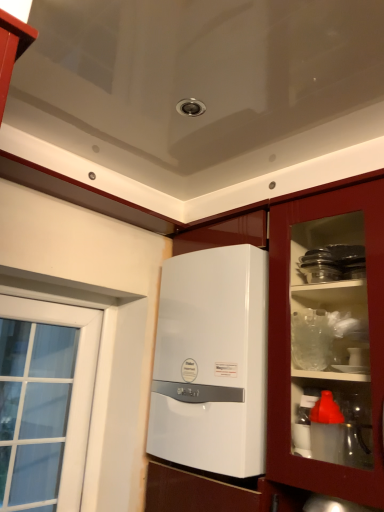
Question: Does white glossy boiler at center have a smaller size compared to white glossy cabinet at center?

Choices:
 (A) yes
 (B) no

Answer: (A)

Question: From a real-world perspective, is white glossy boiler at center on top of white glossy cabinet at center?

Choices:
 (A) yes
 (B) no

Answer: (A)

Question: Considering the relative sizes of white glossy boiler at center and white glossy cabinet at center in the image provided, is white glossy boiler at center thinner than white glossy cabinet at center?

Choices:
 (A) yes
 (B) no

Answer: (A)

Question: Considering the relative sizes of white glossy boiler at center and white glossy cabinet at center in the image provided, is white glossy boiler at center shorter than white glossy cabinet at center?

Choices:
 (A) yes
 (B) no

Answer: (A)

Question: From the image's perspective, does white glossy boiler at center appear higher than white glossy cabinet at center?

Choices:
 (A) yes
 (B) no

Answer: (A)

Question: Can you confirm if white glossy boiler at center is bigger than white glossy cabinet at center?

Choices:
 (A) yes
 (B) no

Answer: (B)

Question: Does white glossy cabinet at center have a larger size compared to white glossy boiler at center?

Choices:
 (A) no
 (B) yes

Answer: (B)

Question: Can we say white glossy cabinet at center lies outside white glossy boiler at center?

Choices:
 (A) no
 (B) yes

Answer: (A)

Question: From the image's perspective, is white glossy cabinet at center under white glossy boiler at center?

Choices:
 (A) yes
 (B) no

Answer: (A)

Question: Can you confirm if white glossy cabinet at center is smaller than white glossy boiler at center?

Choices:
 (A) no
 (B) yes

Answer: (A)

Question: Does white glossy cabinet at center come behind white glossy boiler at center?

Choices:
 (A) yes
 (B) no

Answer: (B)

Question: Would you say white glossy boiler at center is part of white glossy cabinet at center's contents?

Choices:
 (A) no
 (B) yes

Answer: (B)

Question: Visually, is white glossy boiler at center positioned to the left or to the right of white glossy cabinet at center?

Choices:
 (A) left
 (B) right

Answer: (B)